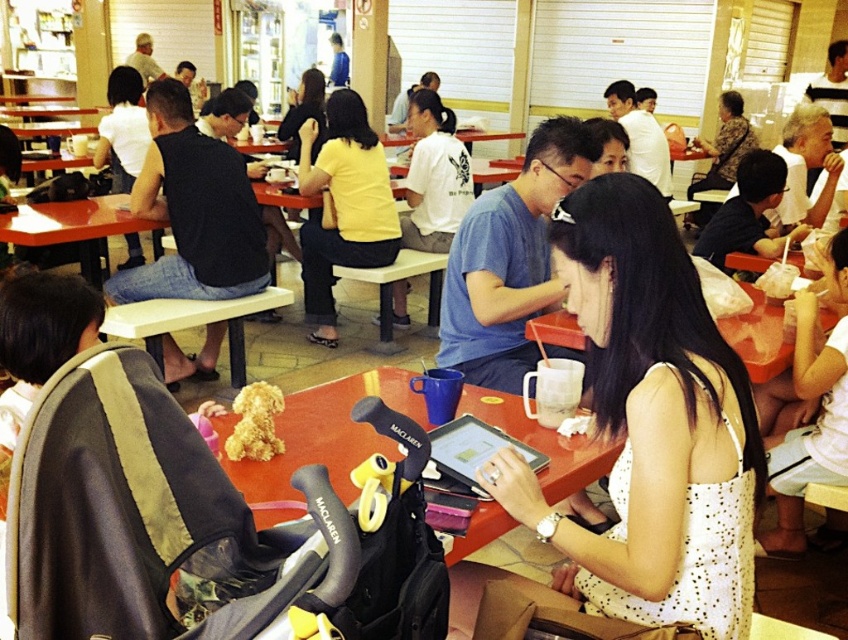
Looking at this image, you are a photographer taking a picture of the white cotton shirt at right and the fluffy golden dog at center in the food court. Which object should you focus on first if you want to capture both in the same frame without moving the camera?

You should focus on the white cotton shirt at right first because it is larger than the fluffy golden dog at center, ensuring it is in clear view before adjusting for the smaller object.

You are a photographer trying to capture a candid shot of the white cotton shirt at right and the fluffy golden dog at center in the food court. Since you want both subjects to appear proportionally sized in your photo, which subject should you move closer to?

Since the white cotton shirt at right is wider than the fluffy golden dog at center, you should move closer to the fluffy golden dog at center to make it larger in the frame, balancing their sizes.